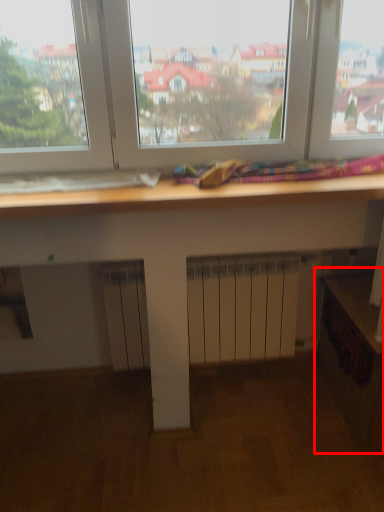
Question: Considering the relative positions of workbench (annotated by the red box) and drawer in the image provided, where is workbench (annotated by the red box) located with respect to the staircase?

Choices:
 (A) right
 (B) left

Answer: (A)